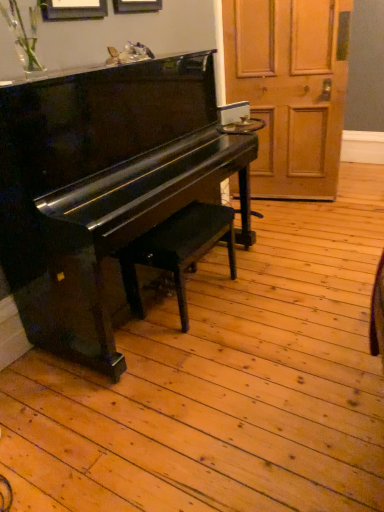
Identify the location of matte black bench at center. The width and height of the screenshot is (384, 512). (178, 250).

Is glossy black piano at left at the left side of matte black bench at center?

Yes.

From a real-world perspective, between glossy black piano at left and matte black bench at center, who is vertically higher?

From a 3D spatial view, glossy black piano at left is above.

You are a GUI agent. You are given a task and a screenshot of the screen. Output one action in this format:
    pyautogui.click(x=<x>, y=<y>)
    Task: Click on the music stool located underneath the glossy black piano at left (from a real-world perspective)
    The height and width of the screenshot is (512, 384).
    Given the screenshot: What is the action you would take?
    pyautogui.click(x=178, y=250)

Is glossy black piano at left oriented away from matte black bench at center?

Correct, glossy black piano at left is looking away from matte black bench at center.

Find the location of `screen door above the glossy black piano at left (from a real-world perspective)`. screen door above the glossy black piano at left (from a real-world perspective) is located at coordinates (290, 89).

From a real-world perspective, relative to wooden door at right, is glossy black piano at left vertically above or below?

From a real-world perspective, glossy black piano at left is physically below wooden door at right.

Does glossy black piano at left turn towards wooden door at right?

No, glossy black piano at left is not turned towards wooden door at right.

In the scene shown: Between glossy black piano at left and wooden door at right, which one has smaller width?

wooden door at right is thinner.

Is matte black bench at center wider or thinner than wooden door at right?

matte black bench at center is wider than wooden door at right.

Which of these two, matte black bench at center or wooden door at right, stands taller?

wooden door at right.

Considering the positions of objects matte black bench at center and wooden door at right in the image provided, who is more to the right, matte black bench at center or wooden door at right?

wooden door at right is more to the right.

Is matte black bench at center bigger or smaller than wooden door at right?

Clearly, matte black bench at center is smaller in size than wooden door at right.

Considering the relative positions of wooden door at right and matte black bench at center in the image provided, is wooden door at right to the right of matte black bench at center from the viewer's perspective?

Indeed, wooden door at right is positioned on the right side of matte black bench at center.

Does wooden door at right have a larger size compared to matte black bench at center?

Yes.

From a real-world perspective, who is located lower, wooden door at right or matte black bench at center?

matte black bench at center.

Measure the distance from wooden door at right to matte black bench at center.

A distance of 4.37 feet exists between wooden door at right and matte black bench at center.

This screenshot has height=512, width=384. What are the coordinates of `screen door above the glossy black piano at left (from a real-world perspective)` in the screenshot? It's located at (290, 89).

Between wooden door at right and glossy black piano at left, which one has more height?

Standing taller between the two is wooden door at right.

In the scene shown: Are wooden door at right and glossy black piano at left located far from each other?

wooden door at right is positioned a significant distance from glossy black piano at left.

How different are the orientations of wooden door at right and glossy black piano at left in degrees?

The facing directions of wooden door at right and glossy black piano at left are 103 degrees apart.

How many degrees apart are the facing directions of matte black bench at center and glossy black piano at left?

The angular difference between matte black bench at center and glossy black piano at left is 0.213 degrees.

Is matte black bench at center not near glossy black piano at left?

They are positioned close to each other.

Can you confirm if matte black bench at center is shorter than glossy black piano at left?

Correct, matte black bench at center is not as tall as glossy black piano at left.

I want to click on piano on the left of matte black bench at center, so click(x=112, y=194).

This screenshot has height=512, width=384. Identify the location of screen door located on the right of glossy black piano at left. (290, 89).

When comparing their distances from matte black bench at center, does wooden door at right or glossy black piano at left seem further?

wooden door at right lies further to matte black bench at center than the other object.

When comparing their distances from glossy black piano at left, does wooden door at right or matte black bench at center seem further?

Among the two, wooden door at right is located further to glossy black piano at left.

Which object lies nearer to the anchor point glossy black piano at left, matte black bench at center or wooden door at right?

matte black bench at center is closer to glossy black piano at left.

From the image, which object appears to be nearer to wooden door at right, glossy black piano at left or matte black bench at center?

The object closer to wooden door at right is glossy black piano at left.

Based on their spatial positions, is matte black bench at center or glossy black piano at left closer to wooden door at right?

The object closer to wooden door at right is glossy black piano at left.

Considering their positions, is glossy black piano at left positioned further to matte black bench at center than wooden door at right?

The object further to matte black bench at center is wooden door at right.

Where is `music stool located between glossy black piano at left and wooden door at right in the depth direction`? music stool located between glossy black piano at left and wooden door at right in the depth direction is located at coordinates (178, 250).